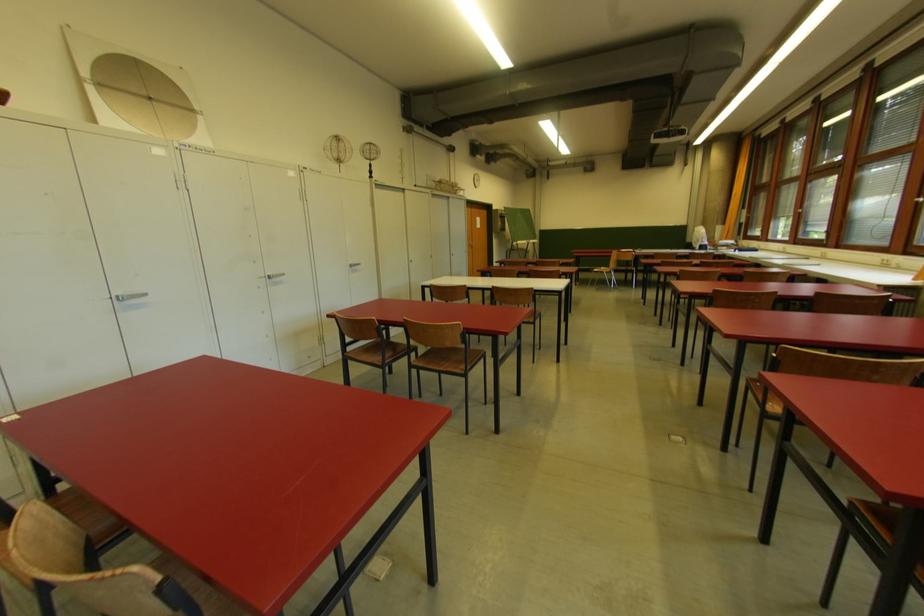
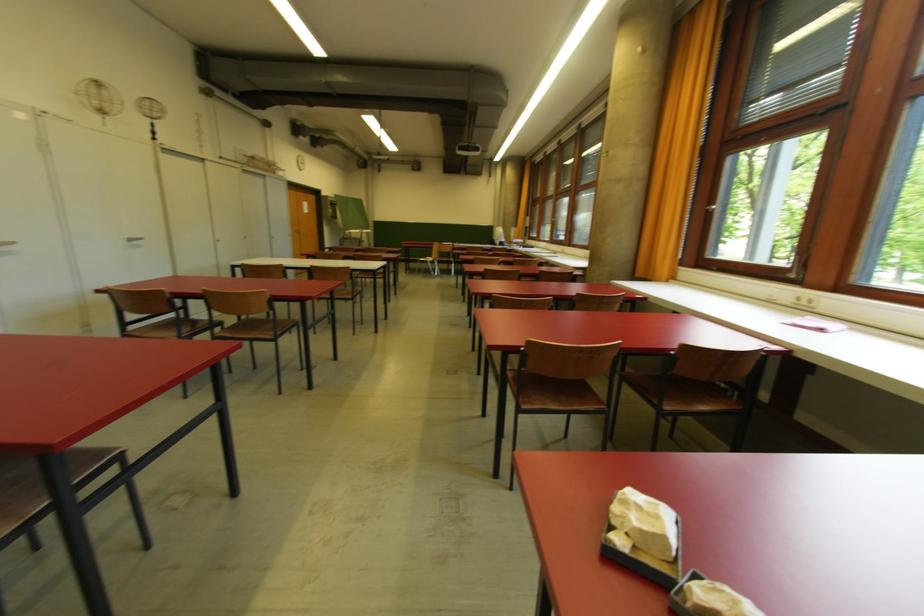
Question: The camera is either moving clockwise (left) or counter-clockwise (right) around the object. The first image is from the beginning of the video and the second image is from the end. Is the camera moving left or right when shooting the video?

Choices:
 (A) Left
 (B) Right

Answer: (A)